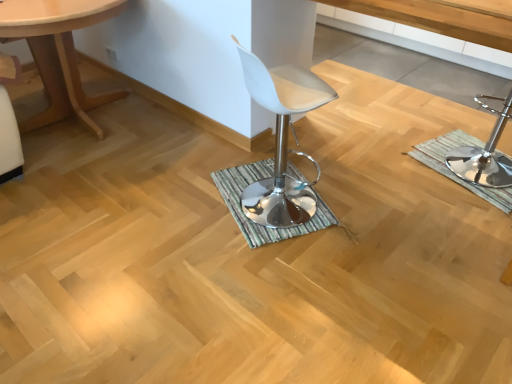
I want to click on blank space situated above green striped bath mat at center, which is counted as the 1th bath mat, starting from the left (from a real-world perspective), so click(253, 198).